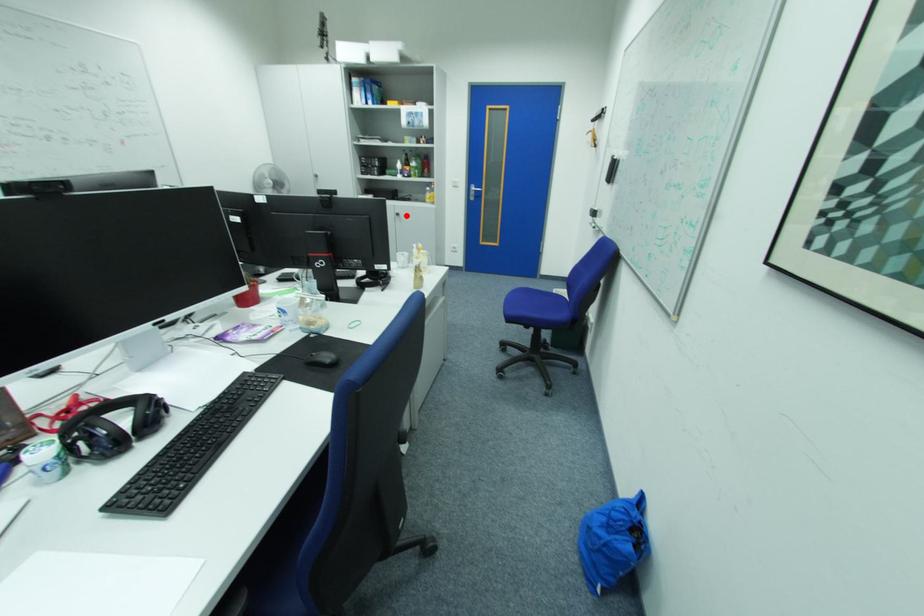
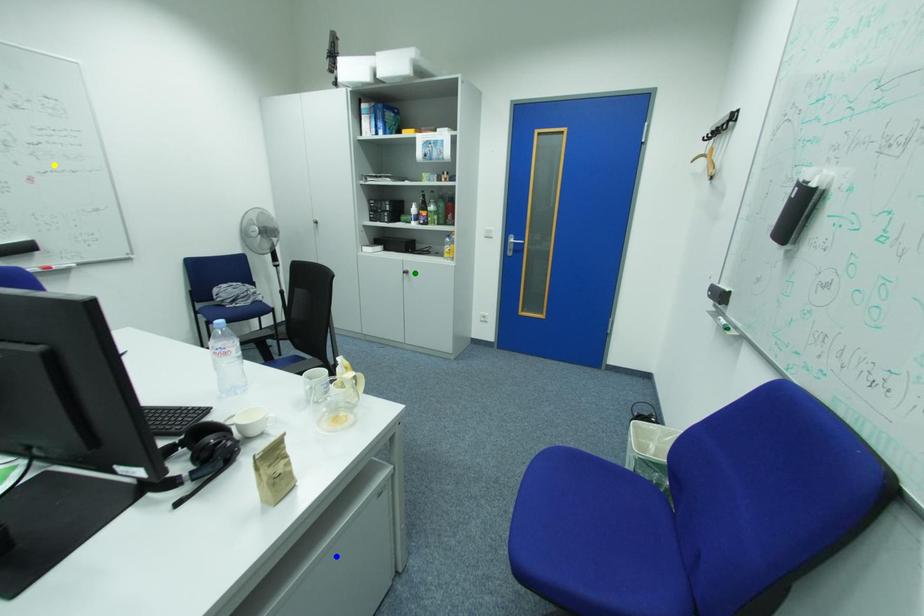
Question: I am providing you with two images of the same scene from different viewpoints. A red point is marked on the first image. You are given multiple points on the second image. Which point in image 2 is actually the same real-world point as the red point in image 1?

Choices:
 (A) green point
 (B) yellow point
 (C) blue point

Answer: (A)